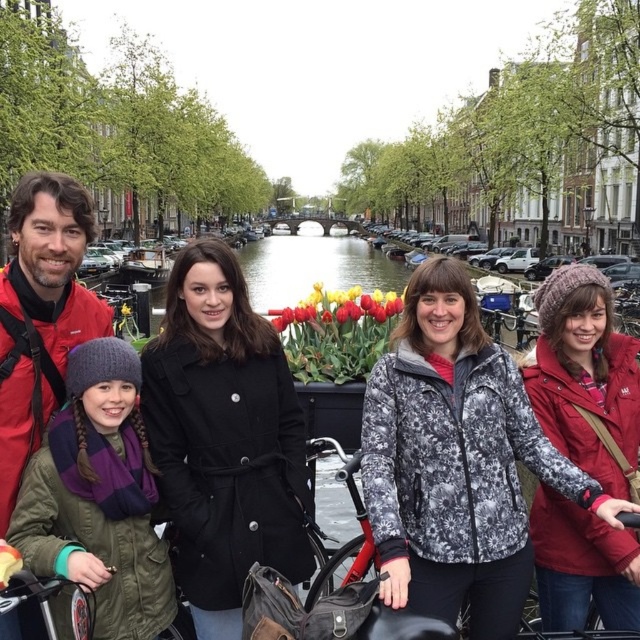
You are a photographer trying to capture a photo of the red fleece jacket at lower right and the red matte bicycle at center. Which object should you focus on first if you want to include both in your frame without moving the camera?

The red fleece jacket at lower right is taller than the red matte bicycle at center, so you should focus on the red fleece jacket at lower right first to ensure its full height fits within the frame while still capturing the bicycle.

You are a photographer standing at the edge of the canal and want to capture a closeup shot of the red fleece jacket at lower right. Given that your camera has a maximum zoom range of 40 meters, will you be able to take the photo without moving closer?

The red fleece jacket at lower right is 44.99 meters away from the camera. Since the camera can only zoom up to 40 meters, you won cannot take the closeup shot without moving closer.

You are a photographer trying to capture a photo of the matte black coat at center and the red matte bicycle at center. Which object should you zoom in more on to ensure both fit in the frame?

The matte black coat at center is wider than the red matte bicycle at center, so you should zoom in more on the matte black coat at center to ensure both fit in the frame.